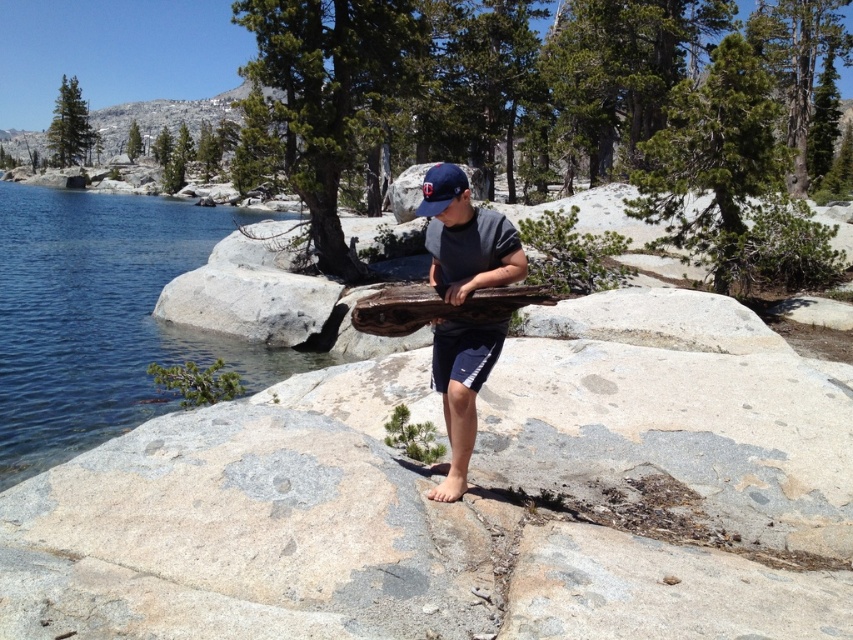
Who is positioned more to the right, clear blue water at left or weathered wood at center?

From the viewer's perspective, weathered wood at center appears more on the right side.

Between clear blue water at left and weathered wood at center, which one is positioned higher?

clear blue water at left is higher up.

Locate an element on the screen. This screenshot has height=640, width=853. clear blue water at left is located at coordinates (102, 317).

Which is behind, point (477, 268) or point (515, 308)?

Point (477, 268)

Locate an element on the screen. This screenshot has height=640, width=853. matte brown wood at center is located at coordinates (465, 237).

Between clear blue water at left and matte brown wood at center, which one appears on the left side from the viewer's perspective?

clear blue water at left is more to the left.

Which is behind, point (9, 445) or point (492, 348)?

Positioned behind is point (9, 445).

Find the location of `clear blue water at left`. clear blue water at left is located at coordinates (102, 317).